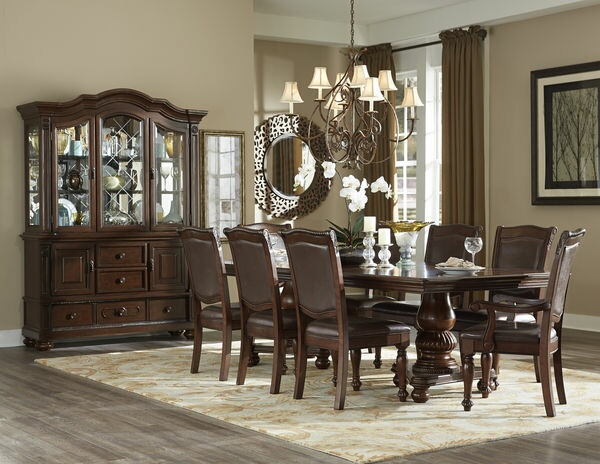
Locate an element on the screen. drawers in curio cabinet is located at coordinates (79, 311), (111, 311), (164, 307), (134, 276), (127, 257).